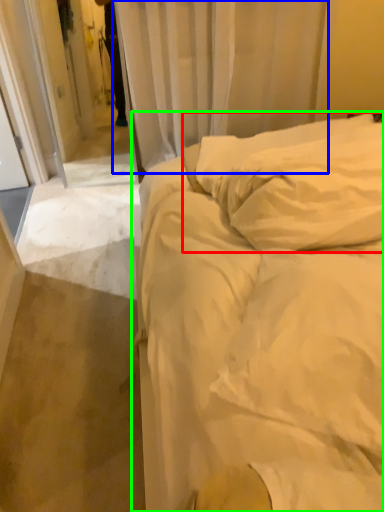
Question: Which object is the closest to the pillow (highlighted by a red box)? Choose among these: curtain (highlighted by a blue box) or bed (highlighted by a green box).

Choices:
 (A) curtain
 (B) bed

Answer: (B)